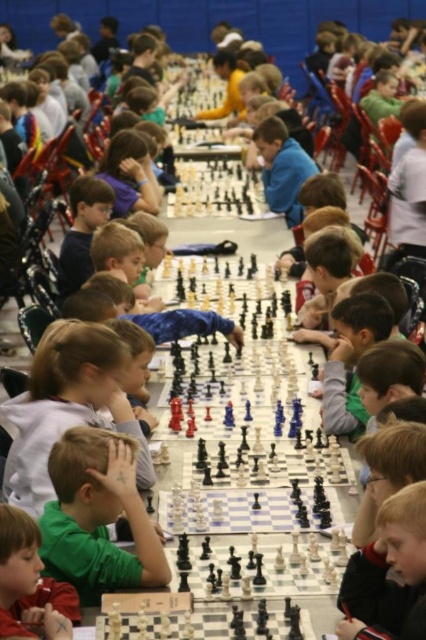
Who is higher up, light brown hair at lower right or light brown hair at lower left?

light brown hair at lower right

Is light brown hair at lower right to the left of light brown hair at lower left from the viewer's perspective?

No, light brown hair at lower right is not to the left of light brown hair at lower left.

Is point (363, 612) positioned before point (8, 536)?

Yes, point (363, 612) is closer to viewer.

The width and height of the screenshot is (426, 640). I want to click on light brown hair at lower right, so (385, 572).

Is green matte shirt at center above light brown hair at lower right?

Yes.

Is green matte shirt at center shorter than light brown hair at lower right?

In fact, green matte shirt at center may be taller than light brown hair at lower right.

Locate an element on the screen. This screenshot has width=426, height=640. green matte shirt at center is located at coordinates (97, 516).

Does point (57, 484) come farther from viewer compared to point (32, 582)?

Yes, point (57, 484) is farther from viewer.

You are a GUI agent. You are given a task and a screenshot of the screen. Output one action in this format:
    pyautogui.click(x=<x>, y=<y>)
    Task: Click on the green matte shirt at center
    The height and width of the screenshot is (640, 426).
    Given the screenshot: What is the action you would take?
    pyautogui.click(x=97, y=516)